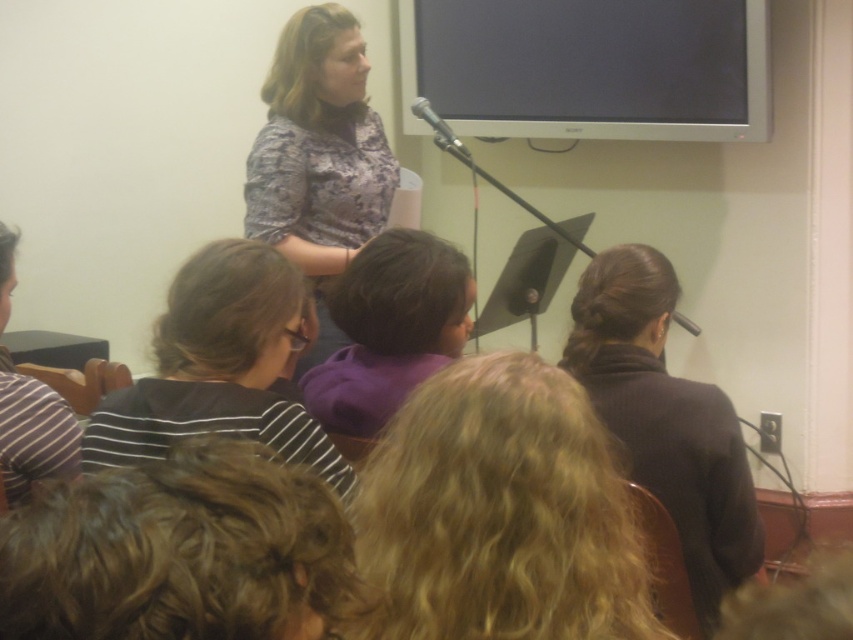
Consider the image. You are sitting in the classroom and want to see the large screen behind the presenter. There are two objects blocking your view, curly blonde hair at lower left and striped fabric at left. Which object is smaller and thus easier to see around?

The curly blonde hair at lower left occupies less space than striped fabric at left, so it is smaller and easier to see around.

You are a speaker who needs to reach both the metallic silver microphone at upper center and the black matte microphone at upper center during your presentation. Can you comfortably reach both microphones if your arm span is 1.2 meters?

The distance between the metallic silver microphone at upper center and the black matte microphone at upper center is 94.02 centimeters. Since your arm span is 1.2 meters, which is longer than the distance between them, you can comfortably reach both microphones.

You are sitting in the classroom and want to look at the curly blonde hair at lower left. Based on its position, where should you direct your gaze?

The curly blonde hair at lower left is located at point (178,550), which means you should direct your gaze to the lower left area of the scene to see it.